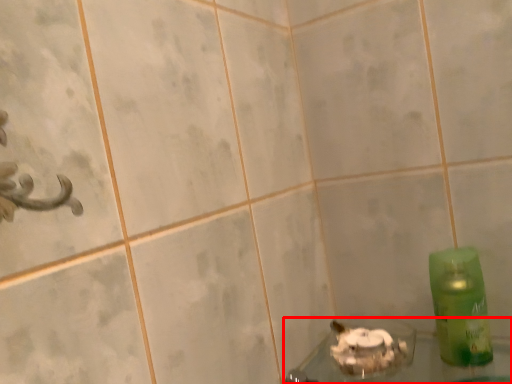
Question: From the image's perspective, where is bath (annotated by the red box) located in relation to bottle in the image?

Choices:
 (A) above
 (B) below

Answer: (B)